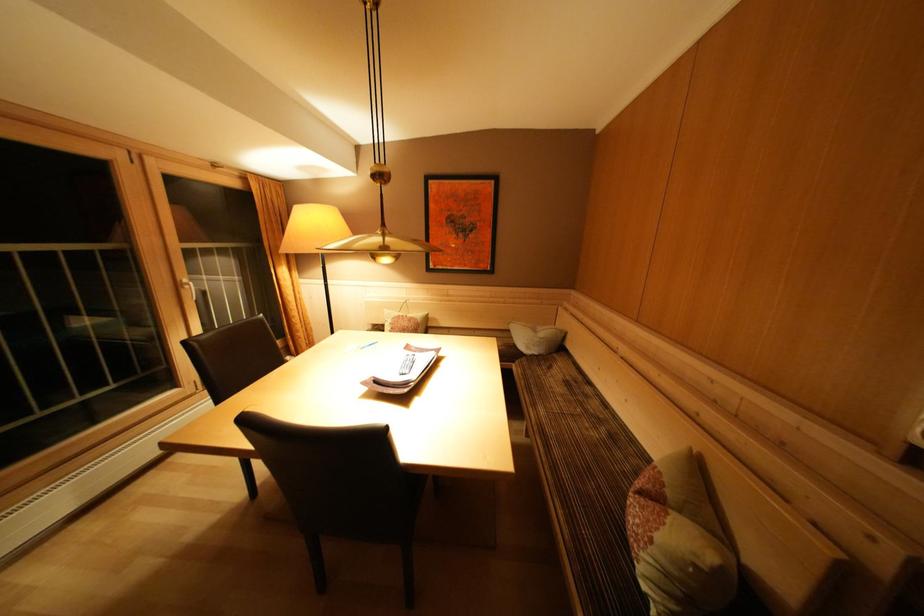
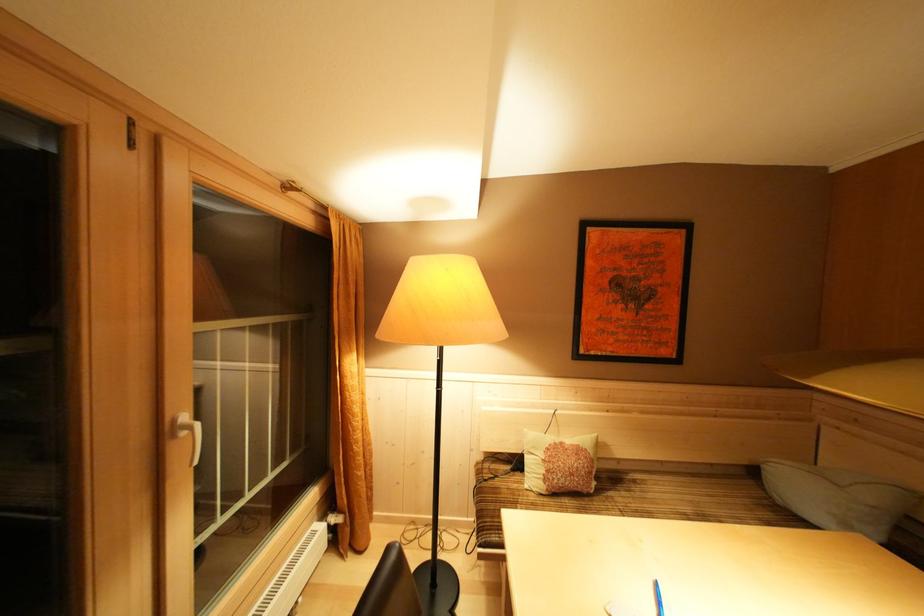
Find the pixel in the second image that matches pixel 409 321 in the first image.

(568, 448)